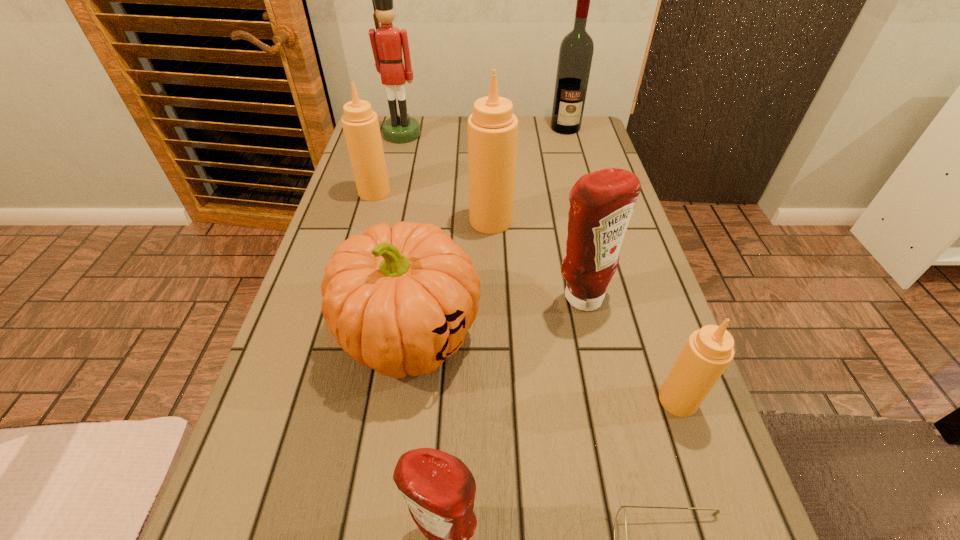
You are a GUI agent. You are given a task and a screenshot of the screen. Output one action in this format:
    pyautogui.click(x=<x>, y=<y>)
    Task: Click on the nutcracker located at the left edge
    
    Given the screenshot: What is the action you would take?
    pyautogui.click(x=387, y=42)

Where is `condiment present at the left edge`? The width and height of the screenshot is (960, 540). condiment present at the left edge is located at coordinates (360, 123).

The width and height of the screenshot is (960, 540). In order to click on pumpkin that is at the left edge in this screenshot , I will do coord(399,300).

Find the location of a particular element. This screenshot has height=540, width=960. alcohol located in the right edge section of the desktop is located at coordinates (576, 50).

Image resolution: width=960 pixels, height=540 pixels. Find the location of `object positioned at the far left corner`. object positioned at the far left corner is located at coordinates (387, 42).

The image size is (960, 540). Identify the location of object located in the far right corner section of the desktop. point(576,50).

Image resolution: width=960 pixels, height=540 pixels. In the image, there is a desktop. Find the location of `vacant space at the far edge`. vacant space at the far edge is located at coordinates (420, 141).

Identify the location of free space at the left edge of the desktop. Image resolution: width=960 pixels, height=540 pixels. point(300,402).

At what (x,y) coordinates should I click in order to perform the action: click on free region at the right edge of the desktop. Please return your answer as a coordinate pair (x, y). Looking at the image, I should click on (606, 328).

Find the location of a particular element. Image resolution: width=960 pixels, height=540 pixels. free space between the leftmost condiment and the right red condiment is located at coordinates (478, 245).